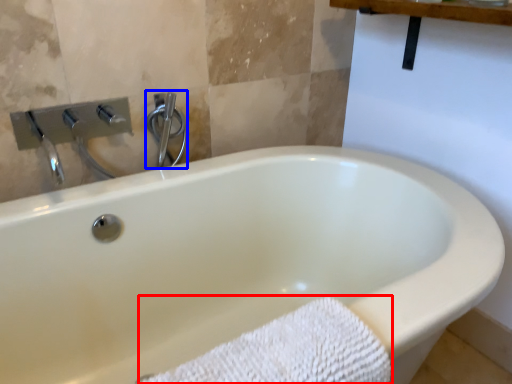
Question: Which point is closer to the camera, bath towel (highlighted by a red box) or shower (highlighted by a blue box)?

Choices:
 (A) bath towel
 (B) shower

Answer: (A)